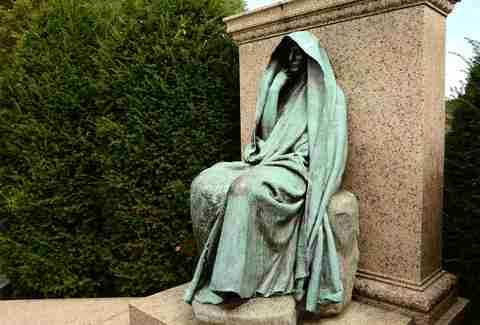
Where is `statue`? statue is located at coordinates (281, 176).